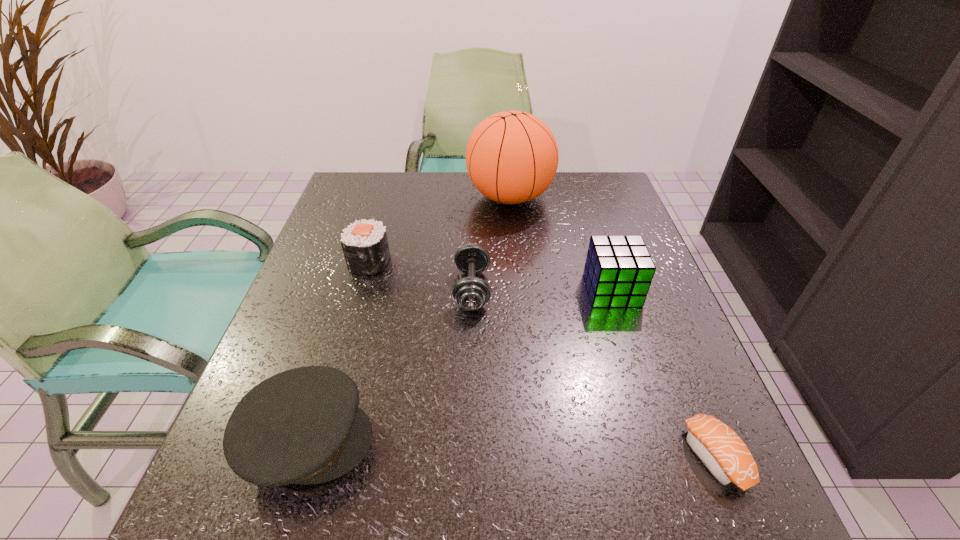
Where is `the closest object to the dumbbell`? This screenshot has width=960, height=540. the closest object to the dumbbell is located at coordinates (365, 246).

I want to click on blank space that satisfies the following two spatial constraints: 1. on the front-facing side of the beret; 2. on the left side of the right sushi, so click(x=302, y=456).

You are a GUI agent. You are given a task and a screenshot of the screen. Output one action in this format:
    pyautogui.click(x=<x>, y=<y>)
    Task: Click on the free location that satisfies the following two spatial constraints: 1. on the front side of the farthest object; 2. on the front-facing side of the beret
    This screenshot has height=540, width=960.
    Given the screenshot: What is the action you would take?
    pyautogui.click(x=533, y=440)

Where is `free space that satisfies the following two spatial constraints: 1. on the front side of the shorter sushi; 2. on the right side of the cube`? The height and width of the screenshot is (540, 960). free space that satisfies the following two spatial constraints: 1. on the front side of the shorter sushi; 2. on the right side of the cube is located at coordinates (665, 456).

Identify the location of free spot that satisfies the following two spatial constraints: 1. on the front side of the farther sushi; 2. on the right side of the shortest object. The image size is (960, 540). (313, 456).

Locate an element on the screen. This screenshot has height=540, width=960. vacant space that satisfies the following two spatial constraints: 1. on the front side of the second shortest object; 2. on the front-facing side of the beret is located at coordinates (469, 440).

What are the coordinates of `vacant space that satisfies the following two spatial constraints: 1. on the front-facing side of the right sushi; 2. on the left side of the beret` in the screenshot? It's located at tap(302, 456).

Find the location of a particular element. This screenshot has width=960, height=540. free point that satisfies the following two spatial constraints: 1. on the front side of the cube; 2. on the right side of the nearer sushi is located at coordinates (665, 456).